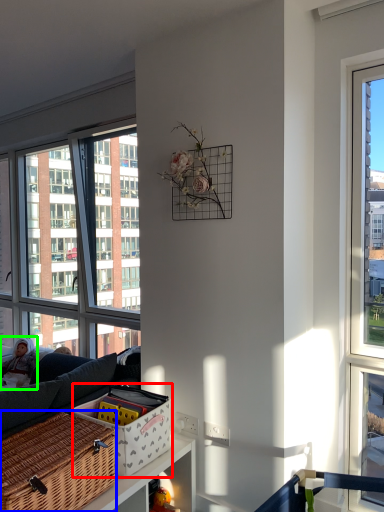
Question: Which object is positioned farthest from basket (highlighted by a red box)? Select from picnic basket (highlighted by a blue box) and couple (highlighted by a green box).

Choices:
 (A) picnic basket
 (B) couple

Answer: (B)